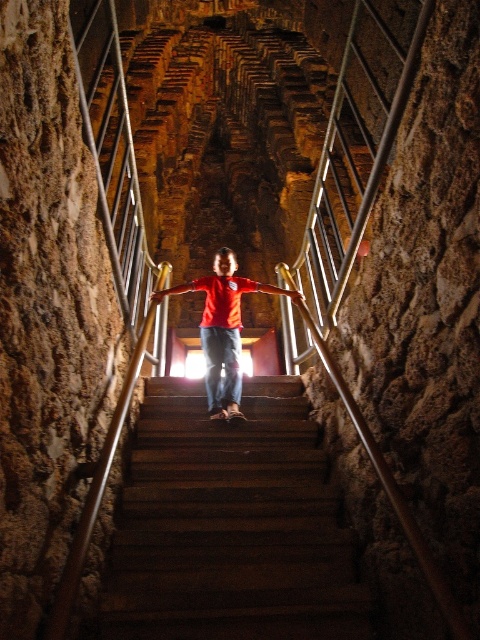
You are a drone operator trying to capture a photo of the wooden stairs at center. The drone is currently hovering at point (229,524). Is the drone above, below, or at the same level as the wooden stairs at center?

The point (229,524) marks the wooden stairs at center, so the drone is at the same level as the wooden stairs at center.

You are a painter who needs to place a 1.2 meter wide canvas on the wooden stairs at center. Considering the width of the matte red shirt at center, can the canvas fit on the stairs?

The wooden stairs at center have a width larger than the matte red shirt at center. Since the shirt is narrower than the stairs, the 1.2 meter wide canvas can fit on the wooden stairs at center provided the shirt isn